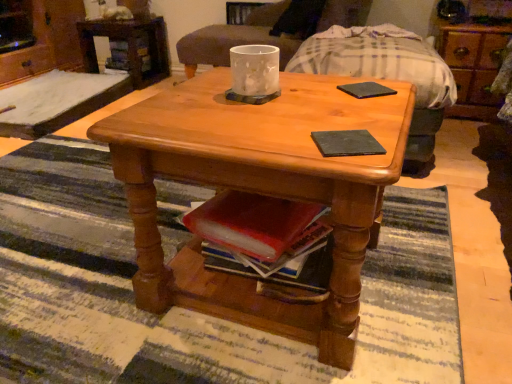
Question: From the image's perspective, is brushed metal dresser at upper left, which appears as the 2th dresser when viewed from the right, below matte glass candle at center?

Choices:
 (A) no
 (B) yes

Answer: (A)

Question: Does brushed metal dresser at upper left, which appears as the 2th dresser when viewed from the right, have a lesser height compared to matte glass candle at center?

Choices:
 (A) yes
 (B) no

Answer: (B)

Question: Is brushed metal dresser at upper left, acting as the first dresser starting from the left, positioned with its back to matte glass candle at center?

Choices:
 (A) no
 (B) yes

Answer: (A)

Question: From the image's perspective, would you say brushed metal dresser at upper left, acting as the first dresser starting from the left, is positioned over matte glass candle at center?

Choices:
 (A) no
 (B) yes

Answer: (B)

Question: Can you confirm if brushed metal dresser at upper left, acting as the first dresser starting from the left, is wider than matte glass candle at center?

Choices:
 (A) yes
 (B) no

Answer: (A)

Question: Can you confirm if brushed metal dresser at upper left, which appears as the 2th dresser when viewed from the right, is bigger than matte glass candle at center?

Choices:
 (A) yes
 (B) no

Answer: (B)

Question: Can you confirm if wooden armchair at center is shorter than black matte pad at center, acting as the second pad starting from the top?

Choices:
 (A) yes
 (B) no

Answer: (B)

Question: From the image's perspective, is wooden armchair at center beneath black matte pad at center, the second pad from the right?

Choices:
 (A) yes
 (B) no

Answer: (B)

Question: Is wooden armchair at center positioned beyond the bounds of black matte pad at center, the 2th pad positioned from the back?

Choices:
 (A) yes
 (B) no

Answer: (A)

Question: Is wooden armchair at center further to the viewer compared to black matte pad at center, which is counted as the first pad, starting from the bottom?

Choices:
 (A) yes
 (B) no

Answer: (A)

Question: Is wooden armchair at center wider than black matte pad at center, the second pad from the right?

Choices:
 (A) no
 (B) yes

Answer: (B)

Question: Is the depth of wooden armchair at center less than that of black matte pad at center, the 2th pad positioned from the back?

Choices:
 (A) no
 (B) yes

Answer: (A)

Question: Is wooden dresser at upper right, the 2th dresser viewed from the left, outside wooden desk at upper left?

Choices:
 (A) no
 (B) yes

Answer: (B)